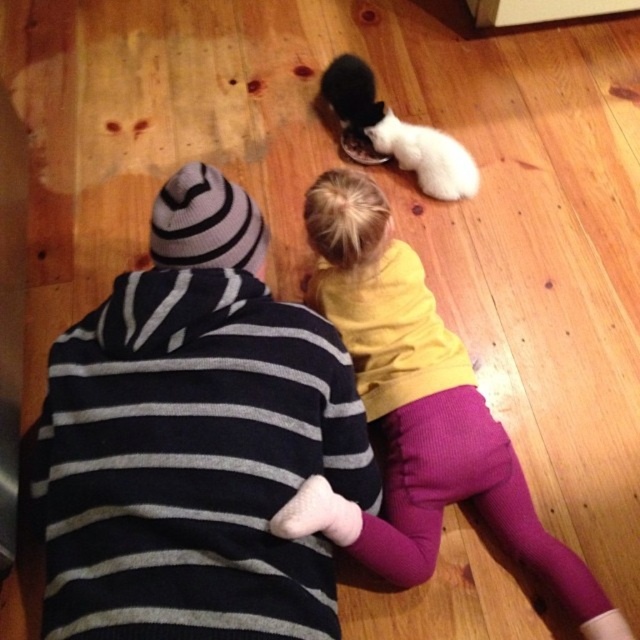
Is yellow fleece shirt at center above black fur cat at center?

No.

Can you confirm if yellow fleece shirt at center is positioned to the right of black fur cat at center?

Indeed, yellow fleece shirt at center is positioned on the right side of black fur cat at center.

Does point (360, 220) come farther from viewer compared to point (360, 128)?

No, (360, 220) is closer to viewer.

Locate an element on the screen. yellow fleece shirt at center is located at coordinates (419, 413).

Who is positioned more to the left, yellow fleece shirt at center or white fluffy cat at center?

From the viewer's perspective, yellow fleece shirt at center appears more on the left side.

Does yellow fleece shirt at center have a larger size compared to white fluffy cat at center?

Yes.

Is point (456, 444) positioned after point (470, 189)?

No.

Locate an element on the screen. The height and width of the screenshot is (640, 640). yellow fleece shirt at center is located at coordinates (419, 413).

Between point (477, 186) and point (342, 113), which one is positioned behind?

The point (342, 113) is behind.

The width and height of the screenshot is (640, 640). I want to click on white fluffy cat at center, so click(x=426, y=156).

You are a GUI agent. You are given a task and a screenshot of the screen. Output one action in this format:
    pyautogui.click(x=<x>, y=<y>)
    Task: Click on the white fluffy cat at center
    
    Given the screenshot: What is the action you would take?
    pyautogui.click(x=426, y=156)